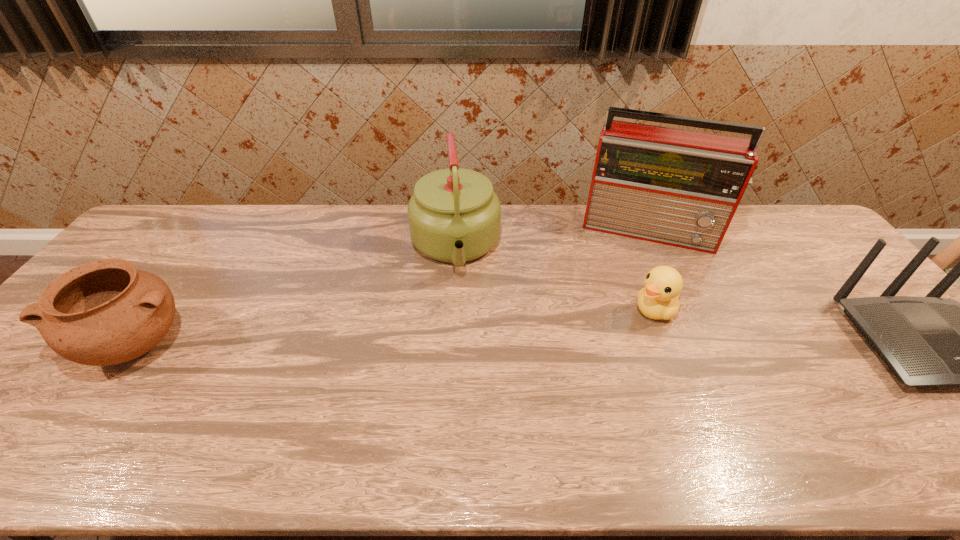
The width and height of the screenshot is (960, 540). Find the location of `blank area at the far edge`. blank area at the far edge is located at coordinates (254, 214).

The height and width of the screenshot is (540, 960). I want to click on vacant region at the near edge of the desktop, so click(x=847, y=411).

Locate an element on the screen. The height and width of the screenshot is (540, 960). vacant area at the left edge is located at coordinates (73, 366).

I want to click on blank space at the far left corner of the desktop, so click(x=175, y=238).

This screenshot has width=960, height=540. I want to click on vacant space that is in between the pottery and the radio receiver, so click(394, 287).

Find the location of a particular element. unoccupied area between the radio receiver and the pottery is located at coordinates (394, 287).

I want to click on free space between the shortest object and the second object from left to right, so click(556, 279).

Locate an element on the screen. This screenshot has width=960, height=540. free spot between the second tallest object and the pottery is located at coordinates (297, 296).

Identify the location of object that is the second closest to the radio receiver. (925, 341).

Identify which object is the second nearest to the leftmost object. Please provide its 2D coordinates. Your answer should be formatted as a tuple, i.e. [(x, y)], where the tuple contains the x and y coordinates of a point satisfying the conditions above.

[(677, 187)]